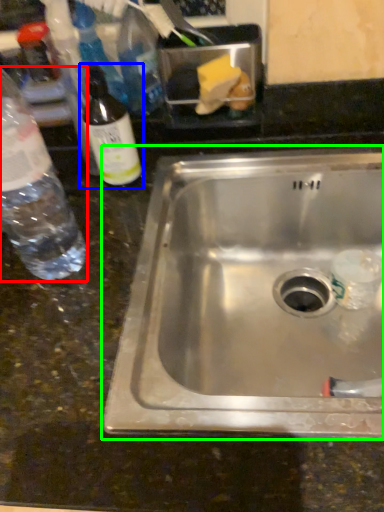
Question: Which is farther away from bottle (highlighted by a red box)? bottle (highlighted by a blue box) or sink (highlighted by a green box)?

Choices:
 (A) bottle
 (B) sink

Answer: (B)